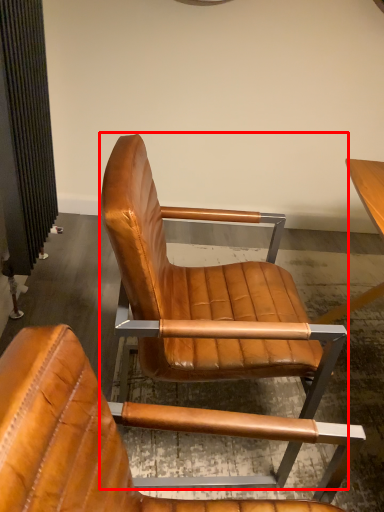
Question: From the image's perspective, what is the correct spatial relationship of chair (annotated by the red box) in relation to chair?

Choices:
 (A) above
 (B) below

Answer: (A)